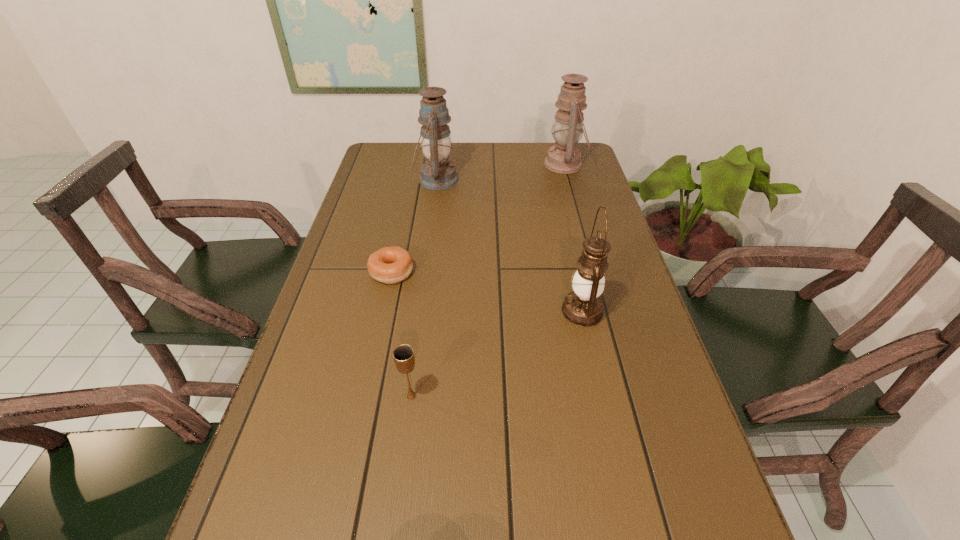
This screenshot has width=960, height=540. In order to click on object present at the left edge in this screenshot , I will do `click(390, 265)`.

You are a GUI agent. You are given a task and a screenshot of the screen. Output one action in this format:
    pyautogui.click(x=<x>, y=<y>)
    Task: Click on the object at the far right corner
    This screenshot has width=960, height=540.
    Given the screenshot: What is the action you would take?
    pyautogui.click(x=564, y=158)

This screenshot has width=960, height=540. Find the location of `free space at the far edge of the desktop`. free space at the far edge of the desktop is located at coordinates (452, 143).

This screenshot has height=540, width=960. I want to click on vacant space at the left edge, so click(x=336, y=363).

The image size is (960, 540). What are the coordinates of `free space at the right edge` in the screenshot? It's located at (644, 504).

Identify the location of free spot at the far right corner of the desktop. (584, 165).

What are the coordinates of `unoccupied area between the leftmost oil lamp and the shortest object` in the screenshot? It's located at (414, 226).

Find the location of `free area in between the shortest object and the fourth farthest object`. free area in between the shortest object and the fourth farthest object is located at coordinates (487, 292).

Locate an element on the screen. The image size is (960, 540). vacant region between the chalice and the nearest oil lamp is located at coordinates (496, 354).

Where is `empty space that is in between the nearest object and the fourth farthest object`? The image size is (960, 540). empty space that is in between the nearest object and the fourth farthest object is located at coordinates (496, 354).